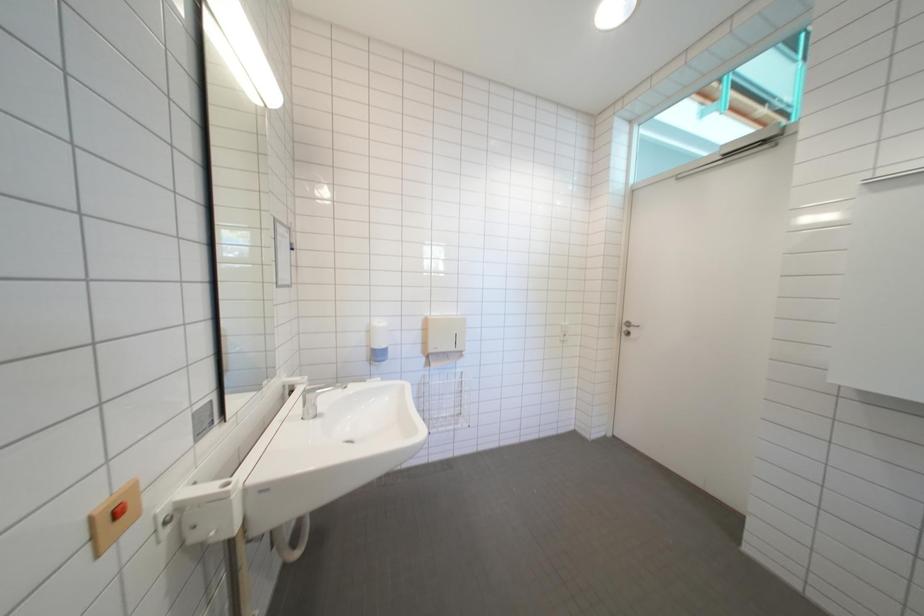
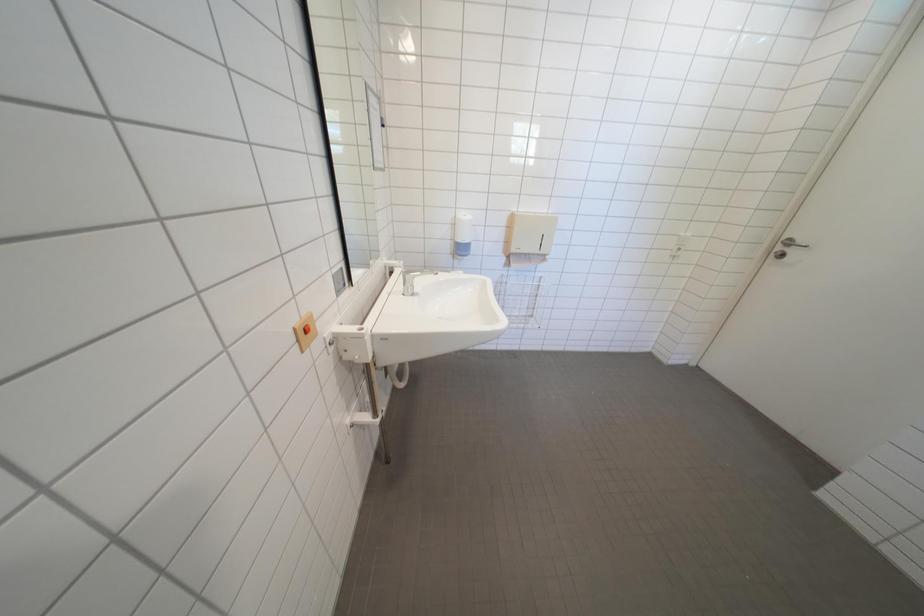
First-person continuous shooting, in which direction is the camera rotating?

The camera's rotation is toward left-down.